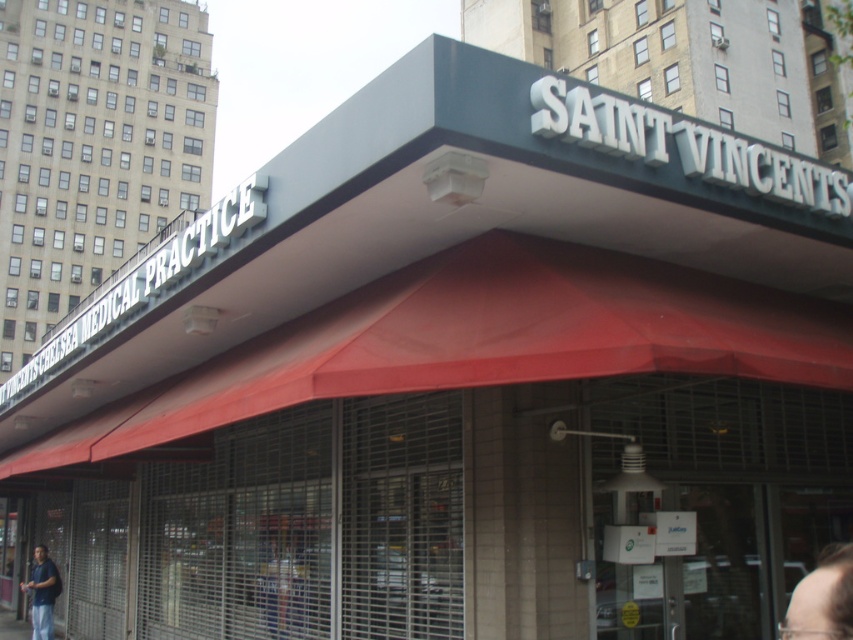
You are a patient arriving at Saint Vincent Medical Practice. You see a person with dark brown hair at lower right and a dark blue shirt at lower left. Which object is on the right side?

The dark brown hair at lower right is positioned on the right side of the dark blue shirt at lower left.

You are a patient arriving at Saint Vincent Medical Practice. You see a person with dark brown hair at lower right and a person in a dark blue shirt at lower left. Which of these two has a narrower width?

The dark brown hair at lower right is thinner than the dark blue shirt at lower left, so the person with dark brown hair at lower right has a narrower width.